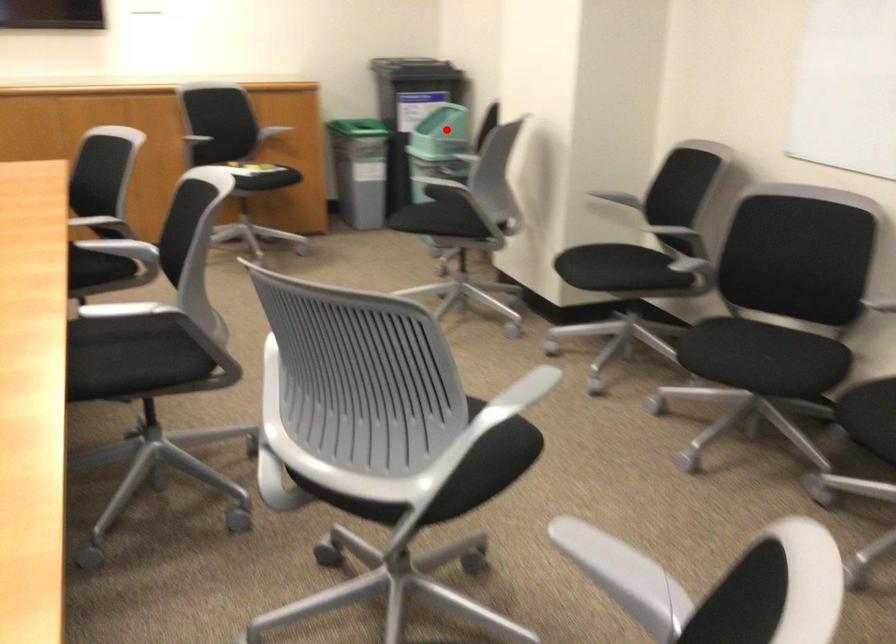
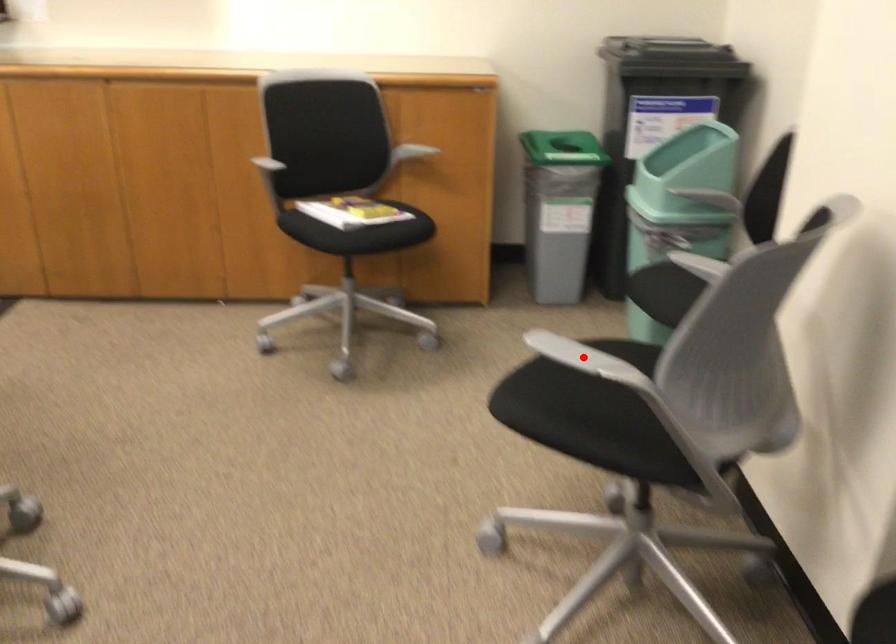
I am providing you with two images of the same scene from different viewpoints. A red point is marked on the first image and another point is marked on the second image. Does the point marked in image1 correspond to the same location as the one in image2?

No